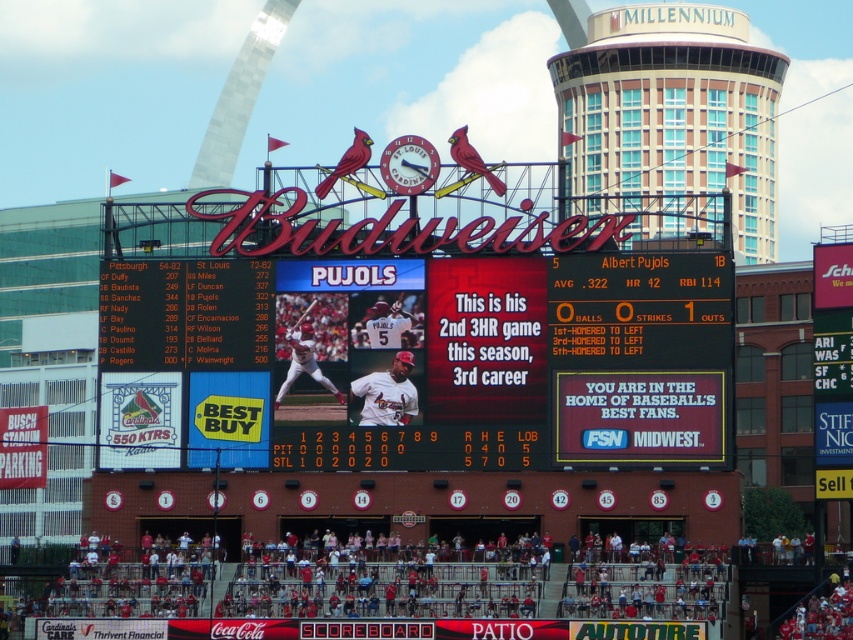
Question: Which object appears farthest from the camera in this image?

Choices:
 (A) white jersey baseball player at center
 (B) matte black scoreboard at center

Answer: (B)

Question: In this image, where is matte black scoreboard at center located relative to white jersey baseball player at center?

Choices:
 (A) right
 (B) left

Answer: (A)

Question: Considering the relative positions of matte black scoreboard at center and white jersey baseball player at center in the image provided, where is matte black scoreboard at center located with respect to white jersey baseball player at center?

Choices:
 (A) below
 (B) above

Answer: (B)

Question: Can you confirm if matte black scoreboard at center is smaller than white jersey baseball player at center?

Choices:
 (A) no
 (B) yes

Answer: (B)